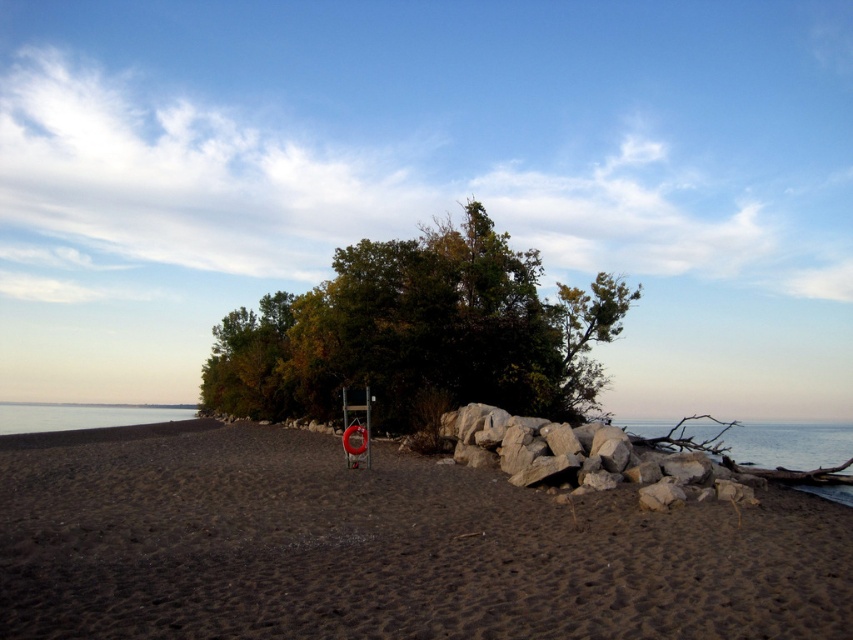
Which is behind, point (601, 525) or point (357, 273)?

Point (357, 273)

The image size is (853, 640). What do you see at coordinates (389, 548) in the screenshot?
I see `dark brown sand at center` at bounding box center [389, 548].

Measure the distance between dark brown sand at center and camera.

5.93 meters

Find the location of a particular element. The width and height of the screenshot is (853, 640). dark brown sand at center is located at coordinates (389, 548).

Does dark brown sand at center appear over clear water at lower right?

Correct, dark brown sand at center is located above clear water at lower right.

Can you confirm if dark brown sand at center is smaller than clear water at lower right?

Yes, dark brown sand at center is smaller than clear water at lower right.

Who is more forward, (108, 444) or (672, 420)?

Point (108, 444) is more forward.

Identify the location of dark brown sand at center. This screenshot has width=853, height=640. (389, 548).

Can you confirm if green leafy tree at center is positioned above clear water at lower right?

Yes.

Is green leafy tree at center wider than clear water at lower right?

In fact, green leafy tree at center might be narrower than clear water at lower right.

At what (x,y) coordinates should I click in order to perform the action: click on green leafy tree at center. Please return your answer as a coordinate pair (x, y). Image resolution: width=853 pixels, height=640 pixels. Looking at the image, I should click on 418,333.